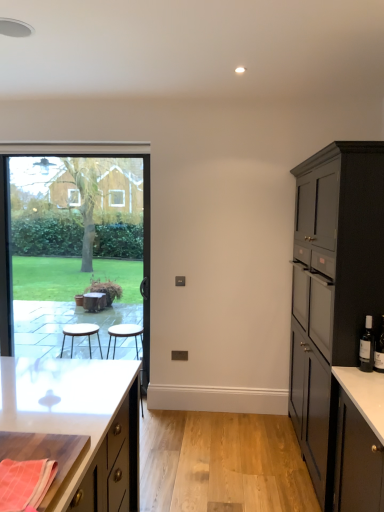
Question: Is wooden cutting board at lower left, which ranks as the first cabinetry in left-to-right order, spatially inside orange woven cloth at lower left, or outside of it?

Choices:
 (A) inside
 (B) outside

Answer: (B)

Question: In the image, is wooden cutting board at lower left, which ranks as the first cabinetry in left-to-right order, positioned in front of or behind orange woven cloth at lower left?

Choices:
 (A) behind
 (B) front

Answer: (A)

Question: Which is nearer to the matte black cabinet at right, marked as the 1th cabinetry in a right-to-left arrangement?

Choices:
 (A) transparent glass window at left
 (B) dark glass wine bottle at right
 (C) orange woven cloth at lower left
 (D) black glass bottle at right
 (E) wooden stool at center

Answer: (D)

Question: Which is nearer to the black glass bottle at right?

Choices:
 (A) transparent glass window at left
 (B) dark glass wine bottle at right
 (C) orange woven cloth at lower left
 (D) wooden cutting board at lower left, which ranks as the first cabinetry in left-to-right order
 (E) matte black cabinet at right, positioned as the second cabinetry in left-to-right order

Answer: (B)